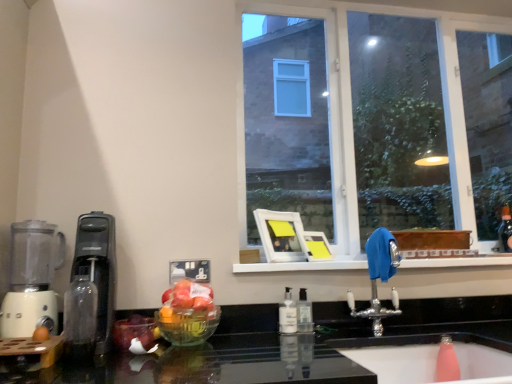
Question: From the image's perspective, is clear plastic soap dispenser at center, the 1th bottle in the back-to-front sequence, above pink rubber sink at lower right?

Choices:
 (A) no
 (B) yes

Answer: (B)

Question: Is clear plastic soap dispenser at center, marked as the first bottle in a right-to-left arrangement, shorter than pink rubber sink at lower right?

Choices:
 (A) no
 (B) yes

Answer: (A)

Question: Is clear plastic soap dispenser at center, marked as the first bottle in a right-to-left arrangement, in front of pink rubber sink at lower right?

Choices:
 (A) no
 (B) yes

Answer: (A)

Question: Considering the relative sizes of clear plastic soap dispenser at center, placed as the 3th bottle when sorted from left to right, and pink rubber sink at lower right in the image provided, is clear plastic soap dispenser at center, placed as the 3th bottle when sorted from left to right, wider than pink rubber sink at lower right?

Choices:
 (A) no
 (B) yes

Answer: (A)

Question: Is clear plastic soap dispenser at center, placed as the 3th bottle when sorted from left to right, located outside pink rubber sink at lower right?

Choices:
 (A) yes
 (B) no

Answer: (A)

Question: Would you say clear plastic soap dispenser at center, acting as the third bottle starting from the front, contains pink rubber sink at lower right?

Choices:
 (A) yes
 (B) no

Answer: (B)

Question: Is pink rubber sink at lower right further to camera compared to shiny red apple at lower left?

Choices:
 (A) no
 (B) yes

Answer: (A)

Question: Is pink rubber sink at lower right at the left side of shiny red apple at lower left?

Choices:
 (A) yes
 (B) no

Answer: (B)

Question: Could you tell me if pink rubber sink at lower right is turned towards shiny red apple at lower left?

Choices:
 (A) yes
 (B) no

Answer: (B)

Question: Is pink rubber sink at lower right not within shiny red apple at lower left?

Choices:
 (A) yes
 (B) no

Answer: (A)

Question: From the image's perspective, is pink rubber sink at lower right located beneath shiny red apple at lower left?

Choices:
 (A) no
 (B) yes

Answer: (B)

Question: From a real-world perspective, is pink rubber sink at lower right under shiny red apple at lower left?

Choices:
 (A) yes
 (B) no

Answer: (A)

Question: From the image's perspective, is transparent glass bottle at left, placed as the 1th bottle when sorted from left to right, below white plastic blender at left?

Choices:
 (A) no
 (B) yes

Answer: (B)